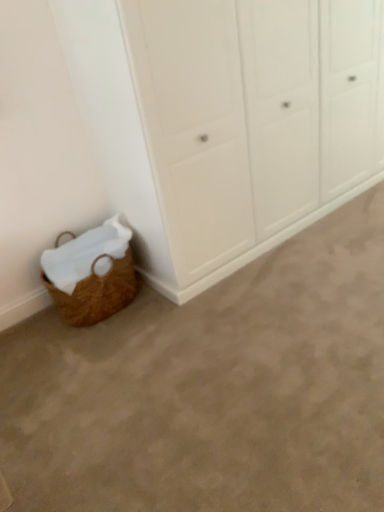
Measure the distance between point (60,289) and camera.

Point (60,289) and camera are 7.05 feet apart.

Find the location of a particular element. brown woven basket at lower left is located at coordinates (91, 274).

Which object is closer to the camera taking this photo, white matte cupboard at lower left or brown woven basket at lower left?

brown woven basket at lower left is in front.

Could you tell me if white matte cupboard at lower left is turned towards brown woven basket at lower left?

Yes.

From a real-world perspective, who is located higher, white matte cupboard at lower left or brown woven basket at lower left?

From a 3D spatial view, white matte cupboard at lower left is above.

Does white matte cupboard at lower left have a greater height compared to brown woven basket at lower left?

Indeed, white matte cupboard at lower left has a greater height compared to brown woven basket at lower left.

Are brown woven basket at lower left and brown woven basket at lower left beside each other?

No, brown woven basket at lower left is not touching brown woven basket at lower left.

Between brown woven basket at lower left and brown woven basket at lower left, which one has larger size?

brown woven basket at lower left is bigger.

In order to click on plain lying on the right of brown woven basket at lower left in this screenshot , I will do `click(212, 388)`.

Based on the photo, considering the sizes of objects brown woven basket at lower left and brown woven basket at lower left in the image provided, who is thinner, brown woven basket at lower left or brown woven basket at lower left?

Thinner between the two is brown woven basket at lower left.

Visually, is brown woven basket at lower left positioned to the left or to the right of white matte cupboard at lower left?

brown woven basket at lower left is to the left of white matte cupboard at lower left.

Is brown woven basket at lower left oriented towards white matte cupboard at lower left?

No, brown woven basket at lower left is not turned towards white matte cupboard at lower left.

Between brown woven basket at lower left and white matte cupboard at lower left, which one has larger width?

brown woven basket at lower left is wider.

Considering the relative sizes of brown woven basket at lower left and white matte cupboard at lower left in the image provided, is brown woven basket at lower left shorter than white matte cupboard at lower left?

Yes, brown woven basket at lower left is shorter than white matte cupboard at lower left.

Is brown woven basket at lower left surrounding white matte cupboard at lower left?

No.

Is brown woven basket at lower left aimed at white matte cupboard at lower left?

No, brown woven basket at lower left is not aimed at white matte cupboard at lower left.

Is point (114, 261) behind point (300, 221)?

No, it is in front of (300, 221).

From the image's perspective, is brown woven basket at lower left under white matte cupboard at lower left?

Correct, brown woven basket at lower left appears lower than white matte cupboard at lower left in the image.

Locate an element on the screen. The height and width of the screenshot is (512, 384). cupboard that appears above the brown woven basket at lower left (from the image's perspective) is located at coordinates (226, 120).

Can you tell me how much white matte cupboard at lower left and brown woven basket at lower left differ in facing direction?

The facing directions of white matte cupboard at lower left and brown woven basket at lower left are 0.882 degrees apart.

Is white matte cupboard at lower left wider than brown woven basket at lower left?

Indeed, white matte cupboard at lower left has a greater width compared to brown woven basket at lower left.

Would you say white matte cupboard at lower left is a long distance from brown woven basket at lower left?

Actually, white matte cupboard at lower left and brown woven basket at lower left are a little close together.

Is brown woven basket at lower left beside brown woven basket at lower left?

brown woven basket at lower left and brown woven basket at lower left are not in contact.

Is brown woven basket at lower left located outside brown woven basket at lower left?

Indeed, brown woven basket at lower left is completely outside brown woven basket at lower left.

From a real-world perspective, which is physically above, brown woven basket at lower left or brown woven basket at lower left?

brown woven basket at lower left is physically above.

Based on the photo, between brown woven basket at lower left and brown woven basket at lower left, which one has less height?

brown woven basket at lower left is shorter.

Locate an element on the screen. The height and width of the screenshot is (512, 384). plain that appears on the left of white matte cupboard at lower left is located at coordinates (212, 388).

This screenshot has height=512, width=384. I want to click on basket behind the brown woven basket at lower left, so click(91, 274).

From the image, which object appears to be farther from brown woven basket at lower left, white matte cupboard at lower left or brown woven basket at lower left?

white matte cupboard at lower left lies further to brown woven basket at lower left than the other object.

Based on their spatial positions, is brown woven basket at lower left or white matte cupboard at lower left closer to brown woven basket at lower left?

brown woven basket at lower left is closer to brown woven basket at lower left.

Estimate the real-world distances between objects in this image. Which object is closer to white matte cupboard at lower left, brown woven basket at lower left or brown woven basket at lower left?

brown woven basket at lower left is positioned closer to the anchor white matte cupboard at lower left.

Estimate the real-world distances between objects in this image. Which object is further from white matte cupboard at lower left, brown woven basket at lower left or brown woven basket at lower left?

brown woven basket at lower left is further to white matte cupboard at lower left.

Considering their positions, is white matte cupboard at lower left positioned closer to brown woven basket at lower left than brown woven basket at lower left?

brown woven basket at lower left is positioned closer to the anchor brown woven basket at lower left.

Which object lies nearer to the anchor point brown woven basket at lower left, brown woven basket at lower left or white matte cupboard at lower left?

Based on the image, brown woven basket at lower left appears to be nearer to brown woven basket at lower left.

Identify the location of basket between white matte cupboard at lower left and brown woven basket at lower left in the up-down direction. This screenshot has height=512, width=384. (91, 274).